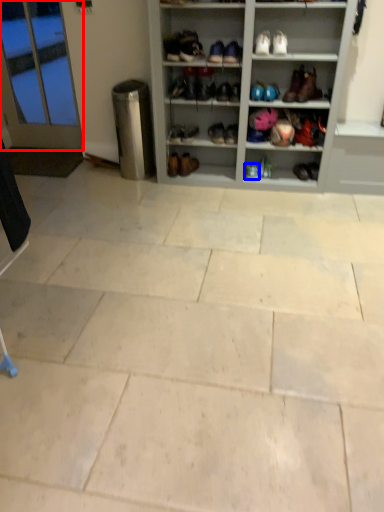
Question: Among these objects, which one is farthest to the camera, glass door (highlighted by a red box) or footwear (highlighted by a blue box)?

Choices:
 (A) glass door
 (B) footwear

Answer: (A)